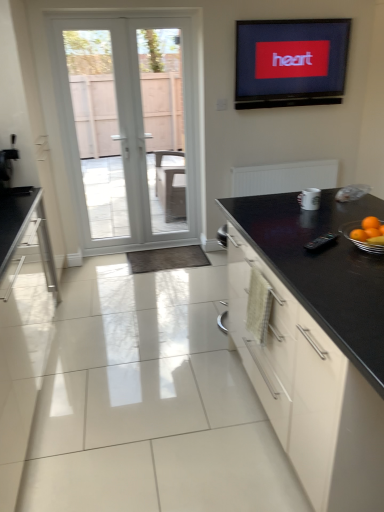
What do you see at coordinates (369, 231) in the screenshot?
I see `orange matte at right` at bounding box center [369, 231].

Image resolution: width=384 pixels, height=512 pixels. What are the coordinates of `white ceramic mug at upper right, which is the 2th appliance in bottom-to-top order` in the screenshot? It's located at (309, 199).

This screenshot has width=384, height=512. I want to click on black plastic remote control at center, placed as the first appliance when sorted from bottom to top, so click(x=321, y=242).

What do you see at coordinates (130, 128) in the screenshot? I see `white glass door at left` at bounding box center [130, 128].

What do you see at coordinates (314, 342) in the screenshot?
I see `black glossy cabinet at right` at bounding box center [314, 342].

This screenshot has height=512, width=384. Find the location of `orange matte at right`. orange matte at right is located at coordinates (369, 231).

From the image's perspective, which one is positioned lower, white ceramic mug at upper right, which ranks as the first appliance in back-to-front order, or white glass door at left?

white ceramic mug at upper right, which ranks as the first appliance in back-to-front order, appears lower in the image.

From a real-world perspective, which is physically above, white ceramic mug at upper right, which is the 2th appliance in bottom-to-top order, or white glass door at left?

white glass door at left.

Is white ceramic mug at upper right, which ranks as the first appliance in back-to-front order, completely or partially outside of white glass door at left?

white ceramic mug at upper right, which ranks as the first appliance in back-to-front order, lies outside white glass door at left's area.

Which of these two, white ceramic mug at upper right, positioned as the first appliance in top-to-bottom order, or white glass door at left, stands taller?

With more height is white glass door at left.

Is orange matte at right positioned beyond the bounds of flat screen tv at upper center?

Yes.

Is orange matte at right looking in the opposite direction of flat screen tv at upper center?

orange matte at right is not turned away from flat screen tv at upper center.

How far apart are orange matte at right and flat screen tv at upper center?

They are 7.06 feet apart.

Based on the photo, from the image's perspective, which is above, white glass door at left or black glossy cabinet at right?

white glass door at left.

From their relative heights in the image, would you say white glass door at left is taller or shorter than black glossy cabinet at right?

Clearly, white glass door at left is taller compared to black glossy cabinet at right.

Is white glass door at left spatially inside black glossy cabinet at right, or outside of it?

white glass door at left is not enclosed by black glossy cabinet at right.

From a real-world perspective, relative to black glossy cabinet at right, is white glass door at left vertically above or below?

From a real-world perspective, white glass door at left is physically above black glossy cabinet at right.

This screenshot has height=512, width=384. Identify the location of electronic lying on the right of orange matte at right. (290, 62).

Would you say flat screen tv at upper center is a long distance from orange matte at right?

Yes, flat screen tv at upper center and orange matte at right are quite far apart.

Relative to orange matte at right, is flat screen tv at upper center in front or behind?

flat screen tv at upper center is behind orange matte at right.

Does flat screen tv at upper center contain orange matte at right?

No.

Identify the location of cabinetry located in front of the black plastic remote control at center, placed as the first appliance when sorted from bottom to top. (314, 342).

Are black plastic remote control at center, the second appliance viewed from the back, and black glossy cabinet at right far apart?

That's not correct — black plastic remote control at center, the second appliance viewed from the back, is a little close to black glossy cabinet at right.

Considering the points (313, 251) and (297, 277), which point is in front, point (313, 251) or point (297, 277)?

The point (297, 277) is more forward.

Is black plastic remote control at center, the first appliance positioned from the front, looking in the opposite direction of black glossy cabinet at right?

black plastic remote control at center, the first appliance positioned from the front, does not have its back to black glossy cabinet at right.

Does point (326, 239) lie in front of point (295, 32)?

Yes.

From a real-world perspective, who is located lower, black plastic remote control at center, which is the 2th appliance in top-to-bottom order, or flat screen tv at upper center?

In real-world perspective, black plastic remote control at center, which is the 2th appliance in top-to-bottom order, is lower.

From the image's perspective, is black plastic remote control at center, placed as the first appliance when sorted from bottom to top, positioned above or below flat screen tv at upper center?

Clearly, from the image's perspective, black plastic remote control at center, placed as the first appliance when sorted from bottom to top, is below flat screen tv at upper center.

You are a GUI agent. You are given a task and a screenshot of the screen. Output one action in this format:
    pyautogui.click(x=<x>, y=<y>)
    Task: Click on the 2nd appliance to the left when counting from the flat screen tv at upper center
    Image resolution: width=384 pixels, height=512 pixels.
    Given the screenshot: What is the action you would take?
    pyautogui.click(x=321, y=242)

You are a GUI agent. You are given a task and a screenshot of the screen. Output one action in this format:
    pyautogui.click(x=<x>, y=<y>)
    Task: Click on the electronic positioned vertically above the white glass door at left (from a real-world perspective)
    
    Given the screenshot: What is the action you would take?
    pyautogui.click(x=290, y=62)

Would you say white glass door at left is outside flat screen tv at upper center?

Yes, white glass door at left is located beyond the bounds of flat screen tv at upper center.

From the image's perspective, which object appears higher, white glass door at left or flat screen tv at upper center?

flat screen tv at upper center.

Is flat screen tv at upper center at the back of white glass door at left?

white glass door at left does not have its back to flat screen tv at upper center.

In the image, there is a white ceramic mug at upper right, which ranks as the first appliance in back-to-front order. Identify the location of door above it (from the image's perspective). (130, 128).

There is a orange matte at right. What are the coordinates of `electronic above it (from a real-world perspective)` in the screenshot? It's located at (290, 62).

From the image, which object appears to be nearer to white glass door at left, orange matte at right or black glossy cabinet at right?

Among the two, black glossy cabinet at right is located nearer to white glass door at left.

Based on their spatial positions, is white ceramic mug at upper right, which is the second appliance from front to back, or white glass door at left closer to black glossy cabinet at right?

white ceramic mug at upper right, which is the second appliance from front to back, lies closer to black glossy cabinet at right than the other object.

Based on their spatial positions, is orange matte at right or flat screen tv at upper center further from black glossy cabinet at right?

Based on the image, flat screen tv at upper center appears to be further to black glossy cabinet at right.

When comparing their distances from white glass door at left, does flat screen tv at upper center or white ceramic mug at upper right, which is the 2th appliance in bottom-to-top order, seem further?

white ceramic mug at upper right, which is the 2th appliance in bottom-to-top order, is positioned further to the anchor white glass door at left.

From the image, which object appears to be nearer to orange matte at right, black plastic remote control at center, the first appliance positioned from the front, or black glossy cabinet at right?

black plastic remote control at center, the first appliance positioned from the front, is closer to orange matte at right.

Which object lies nearer to the anchor point flat screen tv at upper center, orange matte at right or black glossy cabinet at right?

The object closer to flat screen tv at upper center is black glossy cabinet at right.

Considering their positions, is orange matte at right positioned closer to flat screen tv at upper center than white glass door at left?

Based on the image, white glass door at left appears to be nearer to flat screen tv at upper center.

Considering their positions, is black plastic remote control at center, placed as the first appliance when sorted from bottom to top, positioned further to orange matte at right than white ceramic mug at upper right, which is the 2th appliance in bottom-to-top order?

Among the two, white ceramic mug at upper right, which is the 2th appliance in bottom-to-top order, is located further to orange matte at right.

Image resolution: width=384 pixels, height=512 pixels. I want to click on appliance between orange matte at right and white ceramic mug at upper right, positioned as the first appliance in top-to-bottom order, from front to back, so click(321, 242).

The image size is (384, 512). In order to click on orange located between black glossy cabinet at right and white glass door at left in the depth direction in this screenshot , I will do `click(369, 231)`.

I want to click on electronic positioned between orange matte at right and white glass door at left from near to far, so click(290, 62).

The width and height of the screenshot is (384, 512). I want to click on appliance between flat screen tv at upper center and black plastic remote control at center, the first appliance positioned from the front, in the up-down direction, so click(x=309, y=199).